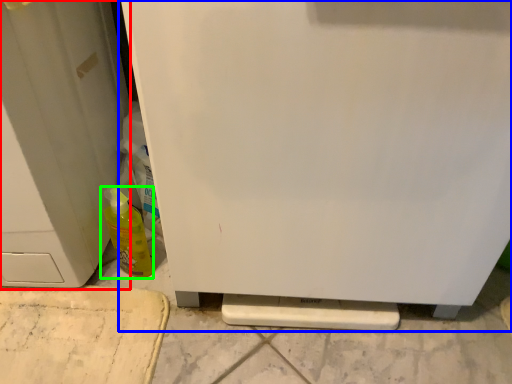
Question: Based on their relative distances, which object is nearer to door (highlighted by a red box)? Choose from refrigerator (highlighted by a blue box) and bottle (highlighted by a green box).

Choices:
 (A) refrigerator
 (B) bottle

Answer: (B)